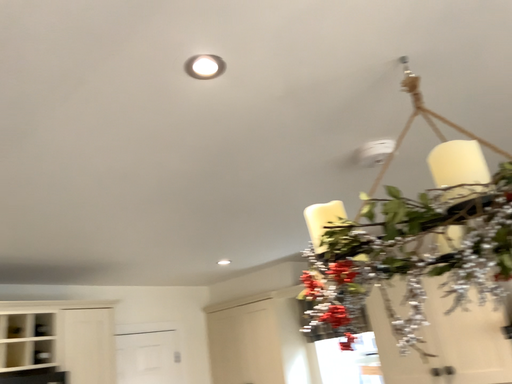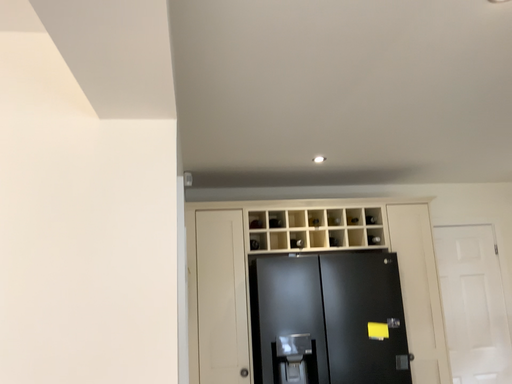
Question: Which way did the camera rotate in the video?

Choices:
 (A) rotated downward
 (B) rotated upward

Answer: (A)